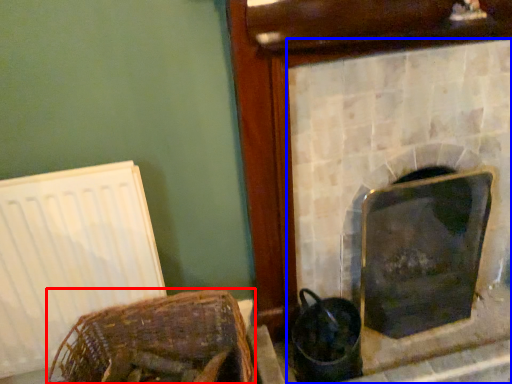
Question: Among these objects, which one is nearest to the camera, basket (highlighted by a red box) or fireplace (highlighted by a blue box)?

Choices:
 (A) basket
 (B) fireplace

Answer: (A)